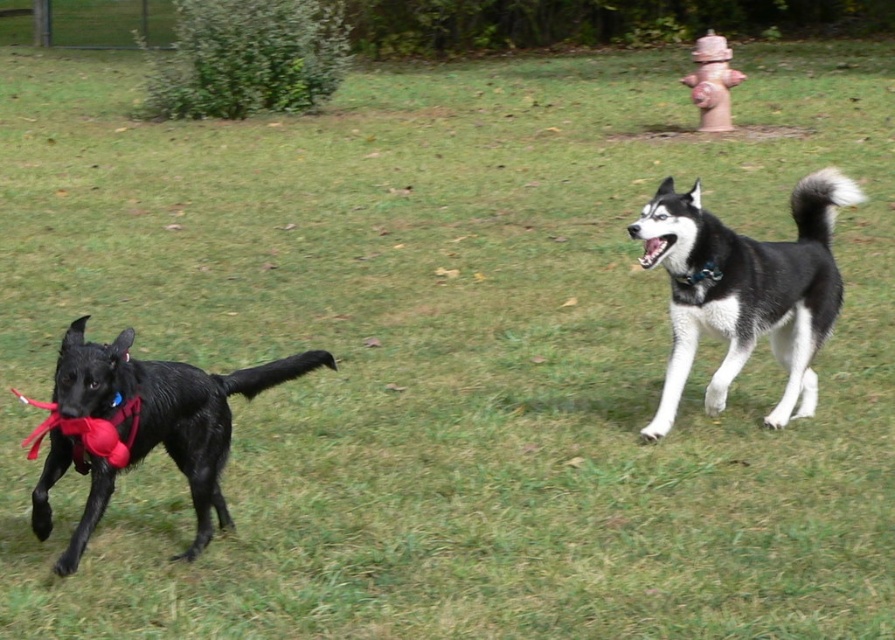
You are a drone operator trying to capture aerial footage of the shiny black dog at left and the red cast iron fire hydrant at upper right. Your drone has a maximum range of 10 meters. Can you film both objects simultaneously without moving the drone?

The shiny black dog at left and the red cast iron fire hydrant at upper right are 11.87 meters apart. Since the drone can only cover 10 meters, it cannot film both objects at the same time without moving.

You are a photographer trying to capture a photo of the white glossy teeth at upper center and the red cast iron fire hydrant at upper right. Since you want to include both in the frame, will you need to adjust your camera angle to see them at the same time?

The white glossy teeth at upper center is behind the red cast iron fire hydrant at upper right, so you will need to adjust your camera angle to see both in the frame at the same time.

You are a photographer trying to capture a wide shot of the two dogs playing in the field. You notice the red cast iron fire hydrant at upper right and the white glossy teeth at upper center in your frame. Which object should you adjust your camera angle to avoid cropping, considering their widths?

The red cast iron fire hydrant at upper right has a greater width than the white glossy teeth at upper center, so you should adjust your camera angle to accommodate the wider red cast iron fire hydrant at upper right to avoid cropping.